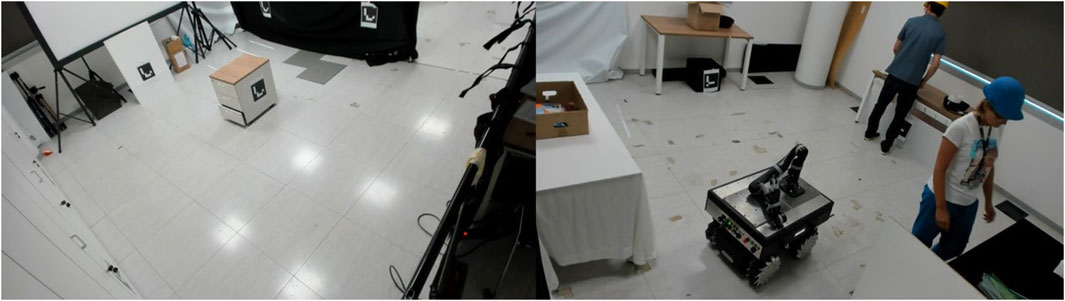
This screenshot has height=301, width=1065. Find the location of `tile floor`. tile floor is located at coordinates (717, 143).